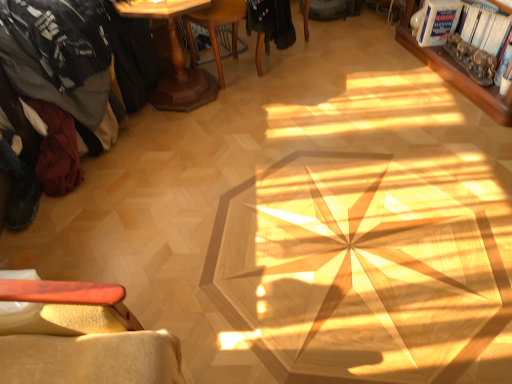
The image size is (512, 384). In order to click on vacant area that is situated to the right of black fabric chair at center, positioned as the 2th chair in left-to-right order in this screenshot , I will do `click(330, 43)`.